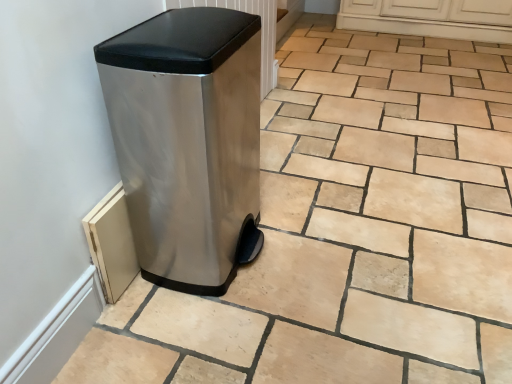
Locate an element on the screen. The height and width of the screenshot is (384, 512). unoccupied space behind stainless steel trash can at left is located at coordinates (265, 177).